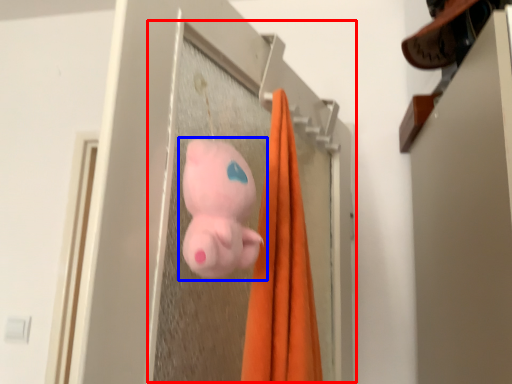
Question: Which of the following is the closest to the observer, screen door (highlighted by a red box) or toy (highlighted by a blue box)?

Choices:
 (A) screen door
 (B) toy

Answer: (B)